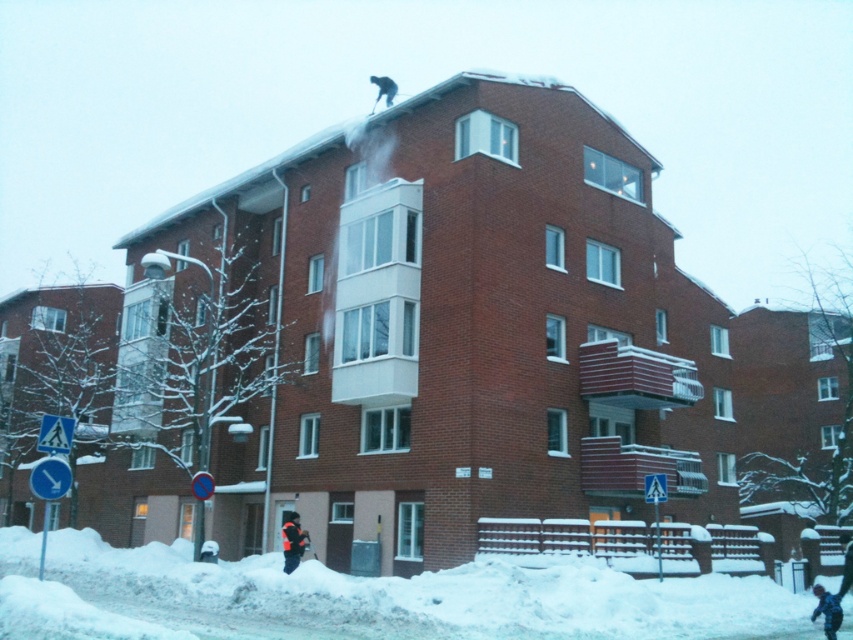
Question: Which object appears farthest from the camera in this image?

Choices:
 (A) white fluffy snow at lower center
 (B) blue fabric jacket at lower right
 (C) white plastic triangle at lower left
 (D) orange fleece jacket at upper center

Answer: (D)

Question: Is orange fleece jacket at upper center thinner than blue fabric jacket at lower right?

Choices:
 (A) no
 (B) yes

Answer: (B)

Question: Which of the following is the farthest from the observer?

Choices:
 (A) white plastic triangle at lower left
 (B) white fluffy snow at lower center

Answer: (A)

Question: Does white fluffy snow at lower center have a lesser width compared to orange fleece jacket at upper center?

Choices:
 (A) yes
 (B) no

Answer: (B)

Question: Is orange fleece jacket at upper center to the left of blue plastic pedestrian crossing sign at lower center from the viewer's perspective?

Choices:
 (A) yes
 (B) no

Answer: (A)

Question: Estimate the real-world distances between objects in this image. Which object is farther from the orange fleece jacket at upper center?

Choices:
 (A) blue plastic pedestrian crossing sign at lower center
 (B) white fluffy snow at lower center
 (C) blue fabric jacket at lower right

Answer: (C)